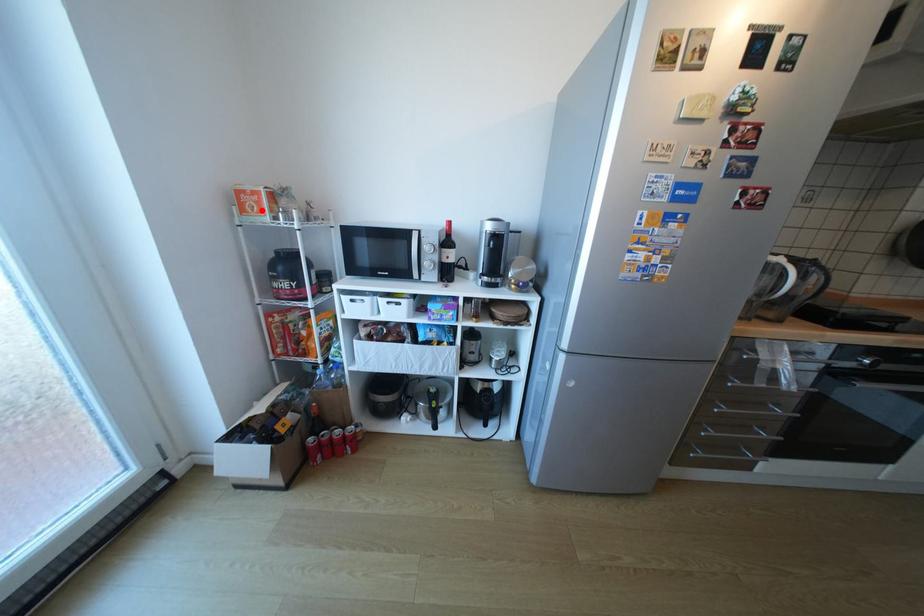
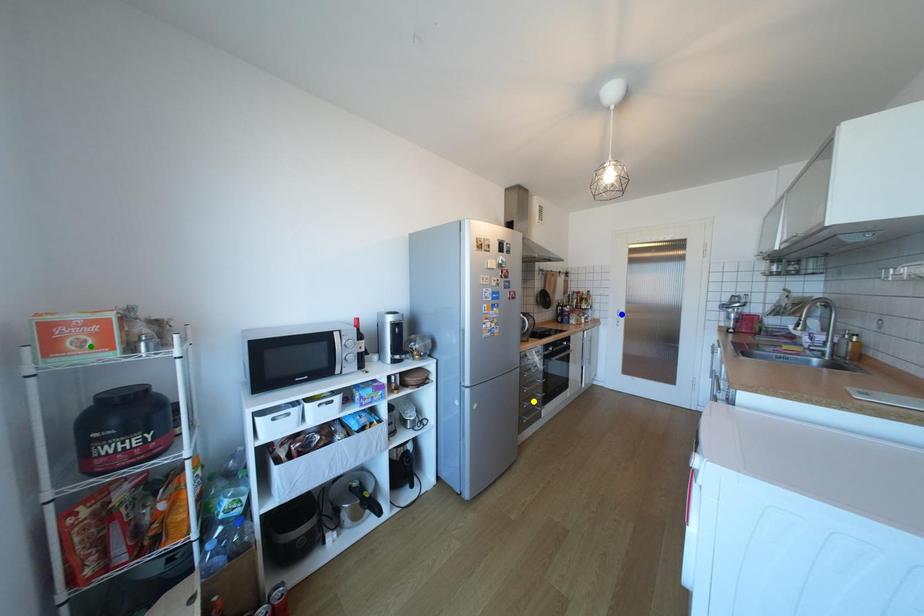
Question: I am providing you with two images of the same scene from different viewpoints. A red point is marked on the first image. You are given multiple points on the second image. Which point in image 2 represents the same 3d spot as the red point in image 1?

Choices:
 (A) blue point
 (B) green point
 (C) yellow point

Answer: (B)